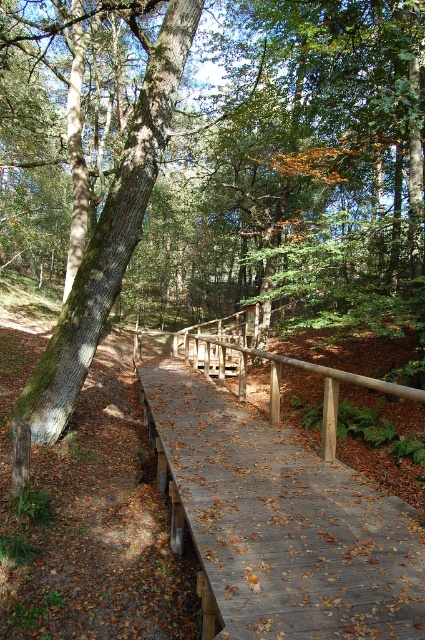
Question: Does wooden bridge at center appear on the right side of brown wooden rail at center?

Choices:
 (A) yes
 (B) no

Answer: (B)

Question: Which is farther from the wooden bridge at center?

Choices:
 (A) green mossy tree at left
 (B) brown wooden rail at center

Answer: (B)

Question: Estimate the real-world distances between objects in this image. Which object is farther from the brown wooden rail at center?

Choices:
 (A) wooden bridge at center
 (B) green mossy tree at left

Answer: (A)

Question: Does green mossy tree at left appear on the left side of brown wooden rail at center?

Choices:
 (A) yes
 (B) no

Answer: (A)

Question: Among these points, which one is nearest to the camera?

Choices:
 (A) (104, 296)
 (B) (312, 364)

Answer: (A)

Question: Is wooden bridge at center to the right of brown wooden rail at center from the viewer's perspective?

Choices:
 (A) yes
 (B) no

Answer: (B)